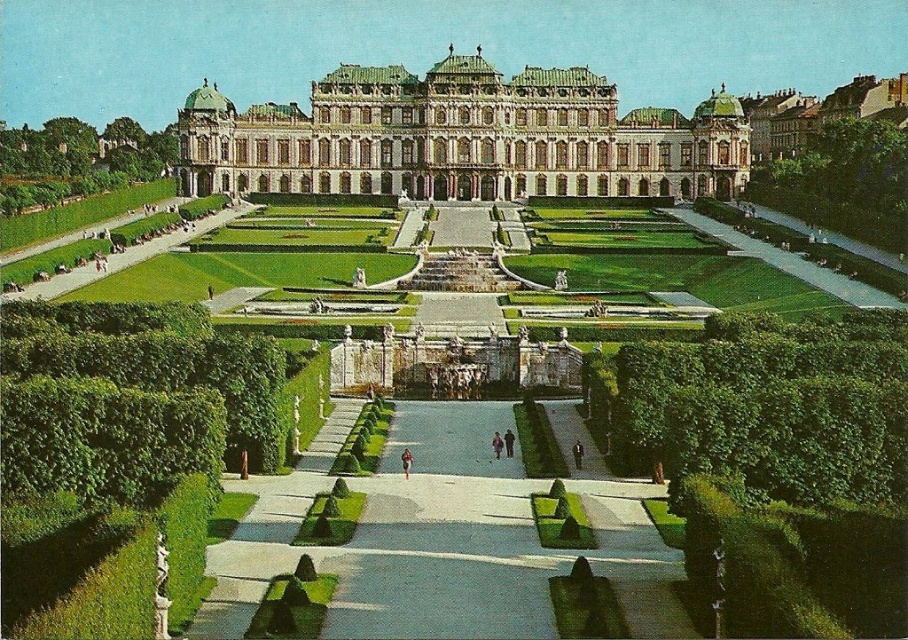
You are a gardener planning to prune the green leafy hedge at lower left and the green leafy hedge at upper right. Based on their heights, which hedge will require a ladder to reach the top?

The green leafy hedge at upper right is taller than the green leafy hedge at lower left, so the gardener will need a ladder for the green leafy hedge at upper right.

You are a landscape architect designing a new garden. You need to place a statue that is 10 meters wide between the green tiled roof at center and the green leafy hedge at lower right. Based on the scene, will the statue fit between them?

The green tiled roof at center is wider than the green leafy hedge at lower right. Since the statue is 10 meters wide, it may not fit between them unless the distance between the two objects is at least 10 meters. However, the description only provides information about their widths, not the distance between them. Therefore, insufficient information is available to determine if the statue will fit.

You are planning to install a long decorative fence that needs to span the distance between the green leafy hedge at lower left and the green leafy hedge at upper right in the garden. The fence must be exactly 100 meters long. Based on the garden layout, will the fence be long enough to connect both hedges?

The distance between the green leafy hedge at lower left and the green leafy hedge at upper right is 106.42 meters. Since the fence is only 100 meters long, it will not be long enough to connect both hedges.